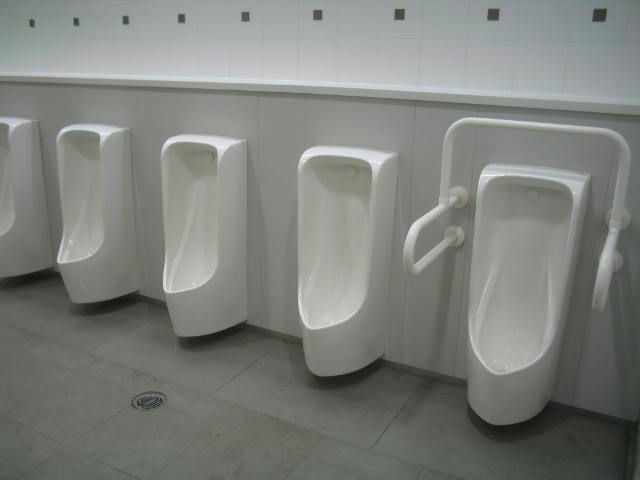
The height and width of the screenshot is (480, 640). In order to click on public restroom in this screenshot , I will do `click(20, 138)`, `click(108, 149)`, `click(227, 159)`, `click(387, 163)`, `click(529, 170)`.